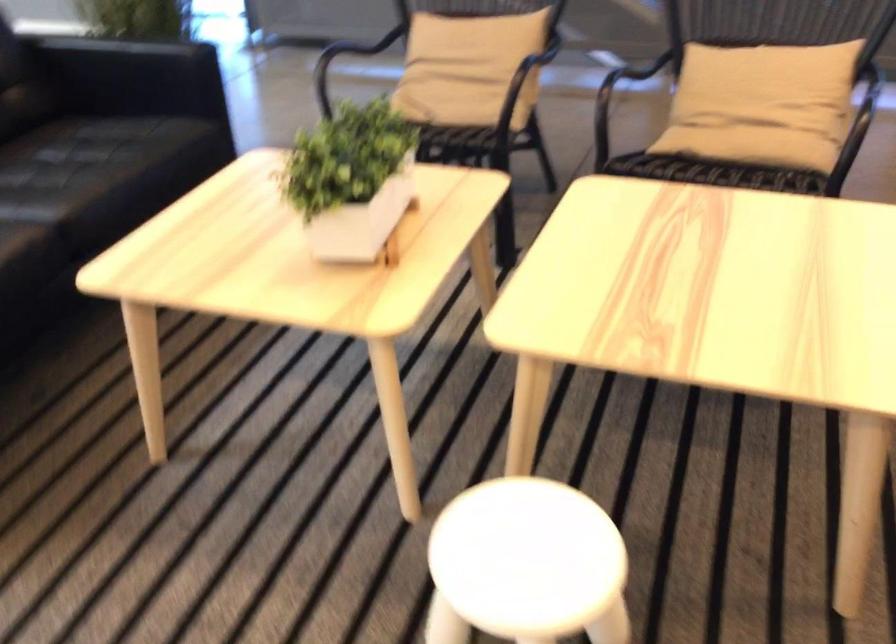
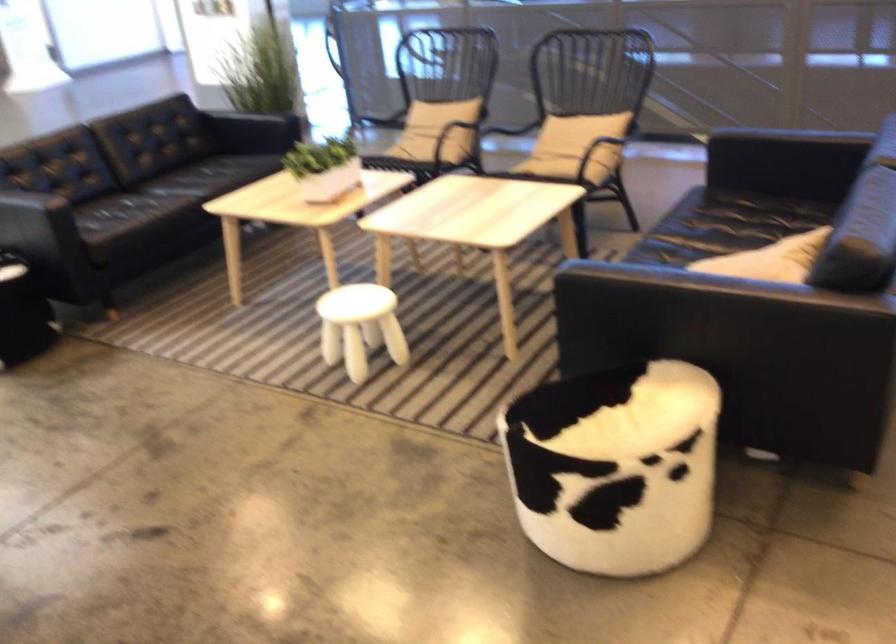
Find the pixel in the second image that matches (x=814, y=122) in the first image.

(574, 147)